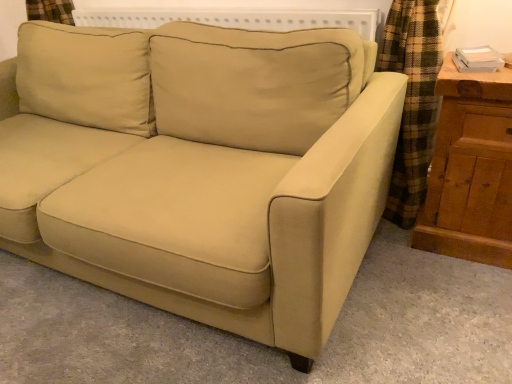
This screenshot has width=512, height=384. Find the location of `vacant area that lies between wooden dresser at right and beige fabric couch at center`. vacant area that lies between wooden dresser at right and beige fabric couch at center is located at coordinates (417, 300).